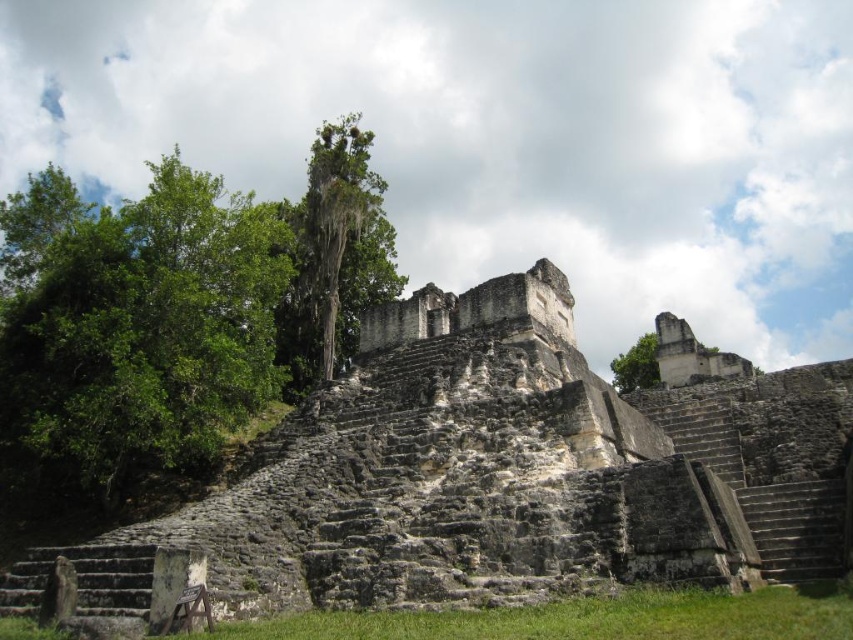
Does green mossy tree at center appear on the right side of green leafy tree at upper right?

No, green mossy tree at center is not to the right of green leafy tree at upper right.

Can you confirm if green mossy tree at center is wider than green leafy tree at upper right?

Yes.

This screenshot has height=640, width=853. Describe the element at coordinates (334, 256) in the screenshot. I see `green mossy tree at center` at that location.

Locate an element on the screen. This screenshot has height=640, width=853. green mossy tree at center is located at coordinates (334, 256).

Which is below, green leafy tree at left or green mossy tree at center?

green mossy tree at center

Between green leafy tree at left and green mossy tree at center, which one is positioned higher?

green leafy tree at left is higher up.

Which is behind, point (33, 461) or point (328, 257)?

Positioned behind is point (328, 257).

The height and width of the screenshot is (640, 853). Identify the location of green leafy tree at left. (136, 324).

Is green leafy tree at left taller than green leafy tree at upper right?

Correct, green leafy tree at left is much taller as green leafy tree at upper right.

Which of these two, green leafy tree at left or green leafy tree at upper right, stands shorter?

With less height is green leafy tree at upper right.

Does point (90, 396) come behind point (631, 371)?

That is False.

Locate an element on the screen. green leafy tree at left is located at coordinates (136, 324).